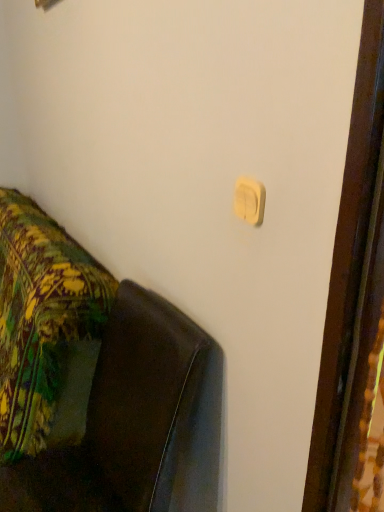
This screenshot has height=512, width=384. What do you see at coordinates (98, 383) in the screenshot?
I see `leather couch at lower left` at bounding box center [98, 383].

Identify the location of leather couch at lower left. The image size is (384, 512). (98, 383).

What is the approximate width of leather couch at lower left?

leather couch at lower left is 18.81 inches in width.

Image resolution: width=384 pixels, height=512 pixels. I want to click on white matte light switch at upper center, so click(249, 200).

Image resolution: width=384 pixels, height=512 pixels. What do you see at coordinates (249, 200) in the screenshot?
I see `white matte light switch at upper center` at bounding box center [249, 200].

Locate an element on the screen. The image size is (384, 512). leather couch at lower left is located at coordinates (98, 383).

Visually, is leather couch at lower left positioned to the left or to the right of white matte light switch at upper center?

From the image, it's evident that leather couch at lower left is to the left of white matte light switch at upper center.

Which object is further away from the camera, leather couch at lower left or white matte light switch at upper center?

white matte light switch at upper center is behind.

Does point (17, 414) come behind point (240, 197)?

Yes, it is behind point (240, 197).

From the image's perspective, is leather couch at lower left over white matte light switch at upper center?

Incorrect, from the image's perspective, leather couch at lower left is lower than white matte light switch at upper center.

From a real-world perspective, who is located lower, leather couch at lower left or white matte light switch at upper center?

From a 3D spatial view, leather couch at lower left is below.

Which object is thinner, leather couch at lower left or white matte light switch at upper center?

With smaller width is white matte light switch at upper center.

Is leather couch at lower left shorter than white matte light switch at upper center?

No, leather couch at lower left is not shorter than white matte light switch at upper center.

Can you confirm if leather couch at lower left is bigger than white matte light switch at upper center?

Yes, leather couch at lower left is bigger than white matte light switch at upper center.

Is white matte light switch at upper center a part of leather couch at lower left?

No, white matte light switch at upper center is located outside of leather couch at lower left.

Are leather couch at lower left and white matte light switch at upper center beside each other?

No.

Is leather couch at lower left facing towards white matte light switch at upper center?

No, leather couch at lower left is not aimed at white matte light switch at upper center.

How far apart are leather couch at lower left and white matte light switch at upper center?

leather couch at lower left and white matte light switch at upper center are 78.54 centimeters apart from each other.

In order to click on light switch above the leather couch at lower left (from the image's perspective) in this screenshot , I will do `click(249, 200)`.

Does white matte light switch at upper center appear on the left side of leather couch at lower left?

No.

Which object is more forward, white matte light switch at upper center or leather couch at lower left?

leather couch at lower left.

Which is in front, point (239, 189) or point (103, 337)?

The point (239, 189) is in front.

From the image's perspective, is white matte light switch at upper center located above or below leather couch at lower left?

white matte light switch at upper center is above leather couch at lower left.

From a real-world perspective, between white matte light switch at upper center and leather couch at lower left, who is vertically lower?

In real-world perspective, leather couch at lower left is lower.

Between white matte light switch at upper center and leather couch at lower left, which one has larger width?

Wider between the two is leather couch at lower left.

Considering the sizes of white matte light switch at upper center and leather couch at lower left in the image, is white matte light switch at upper center taller or shorter than leather couch at lower left?

Considering their sizes, white matte light switch at upper center has less height than leather couch at lower left.

Is white matte light switch at upper center smaller than leather couch at lower left?

Correct, white matte light switch at upper center occupies less space than leather couch at lower left.

Is white matte light switch at upper center inside or outside of leather couch at lower left?

white matte light switch at upper center is spatially situated outside leather couch at lower left.

Is white matte light switch at upper center positioned far away from leather couch at lower left?

No, white matte light switch at upper center is not far from leather couch at lower left.

Is white matte light switch at upper center oriented towards leather couch at lower left?

No, white matte light switch at upper center is not oriented towards leather couch at lower left.

This screenshot has width=384, height=512. I want to click on light switch that is above the leather couch at lower left (from a real-world perspective), so click(x=249, y=200).

Identify the location of furniture located below the white matte light switch at upper center (from the image's perspective). (98, 383).

Where is `furniture below the white matte light switch at upper center (from a real-world perspective)`? furniture below the white matte light switch at upper center (from a real-world perspective) is located at coordinates (98, 383).